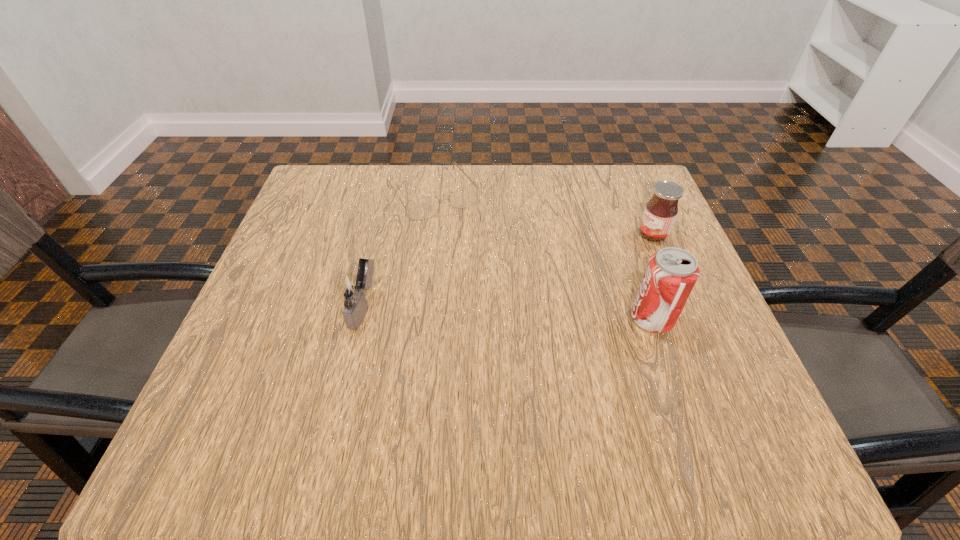
At what (x,y) coordinates should I click in order to perform the action: click on vacant area between the igniter and the jam. Please return your answer as a coordinate pair (x, y). Looking at the image, I should click on (507, 271).

Where is `free spot between the spectacles and the jam`? This screenshot has width=960, height=540. free spot between the spectacles and the jam is located at coordinates (542, 214).

Select which object appears as the third closest to the igniter. Please provide its 2D coordinates. Your answer should be formatted as a tuple, i.e. [(x, y)], where the tuple contains the x and y coordinates of a point satisfying the conditions above.

[(660, 213)]

You are a GUI agent. You are given a task and a screenshot of the screen. Output one action in this format:
    pyautogui.click(x=<x>, y=<y>)
    Task: Click on the object that ranks as the closest to the soda can
    The height and width of the screenshot is (540, 960).
    Given the screenshot: What is the action you would take?
    pyautogui.click(x=660, y=213)

You are a GUI agent. You are given a task and a screenshot of the screen. Output one action in this format:
    pyautogui.click(x=<x>, y=<y>)
    Task: Click on the free location that satisfies the following two spatial constraints: 1. on the back side of the farthest object; 2. on the left side of the igniter
    Image resolution: width=960 pixels, height=540 pixels.
    Given the screenshot: What is the action you would take?
    pyautogui.click(x=390, y=193)

Locate an element on the screen. Image resolution: width=960 pixels, height=540 pixels. free spot that satisfies the following two spatial constraints: 1. on the front side of the farthest object; 2. on the right side of the jam is located at coordinates pyautogui.click(x=426, y=234).

Find the location of a particular element. The height and width of the screenshot is (540, 960). vacant region that satisfies the following two spatial constraints: 1. on the back side of the spectacles; 2. on the left side of the igniter is located at coordinates (390, 193).

You are a GUI agent. You are given a task and a screenshot of the screen. Output one action in this format:
    pyautogui.click(x=<x>, y=<y>)
    Task: Click on the free space that satisfies the following two spatial constraints: 1. on the front side of the igniter; 2. on the right side of the tallest object
    
    Given the screenshot: What is the action you would take?
    pyautogui.click(x=359, y=319)

Where is `blank area in the image that satisfies the following two spatial constraints: 1. on the front side of the igniter; 2. on the left side of the soda can`? blank area in the image that satisfies the following two spatial constraints: 1. on the front side of the igniter; 2. on the left side of the soda can is located at coordinates (359, 319).

This screenshot has width=960, height=540. I want to click on vacant area that satisfies the following two spatial constraints: 1. on the front side of the soda can; 2. on the right side of the shortest object, so click(x=416, y=319).